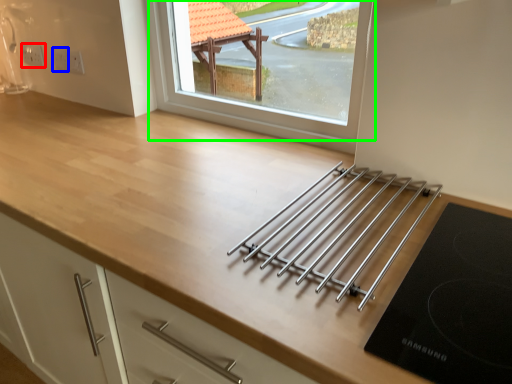
Question: Which is farther away from electric outlet (highlighted by a red box)? electric outlet (highlighted by a blue box) or window (highlighted by a green box)?

Choices:
 (A) electric outlet
 (B) window

Answer: (B)